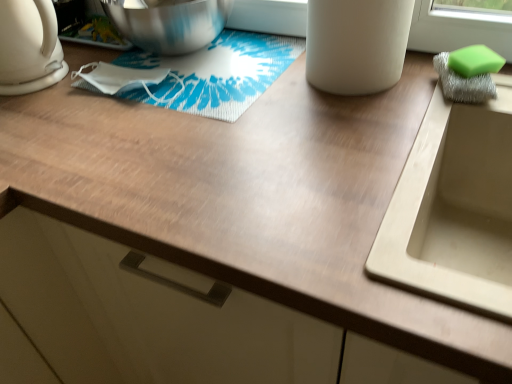
The width and height of the screenshot is (512, 384). Find the location of `free space that is in between green sponge at right and white matte cup at upper center`. free space that is in between green sponge at right and white matte cup at upper center is located at coordinates (418, 83).